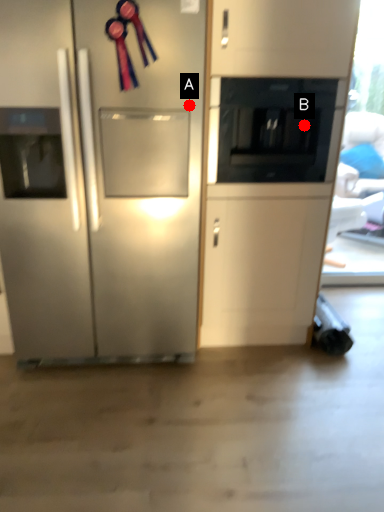
Question: Two points are circled on the image, labeled by A and B beside each circle. Among these points, which one is nearest to the camera?

Choices:
 (A) A is closer
 (B) B is closer

Answer: (A)